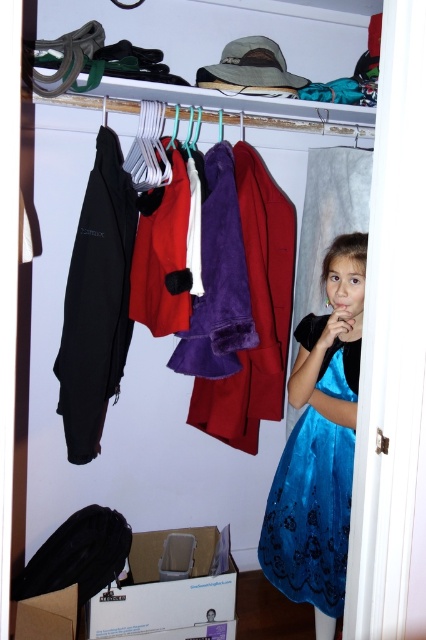
Who is taller, velvet blue dress at lower right or matte black jacket at left?

matte black jacket at left

Between point (336, 476) and point (69, 296), which one is positioned in front?

Point (336, 476) is in front.

This screenshot has width=426, height=640. In order to click on velvet blue dress at lower right in this screenshot , I will do click(x=310, y=513).